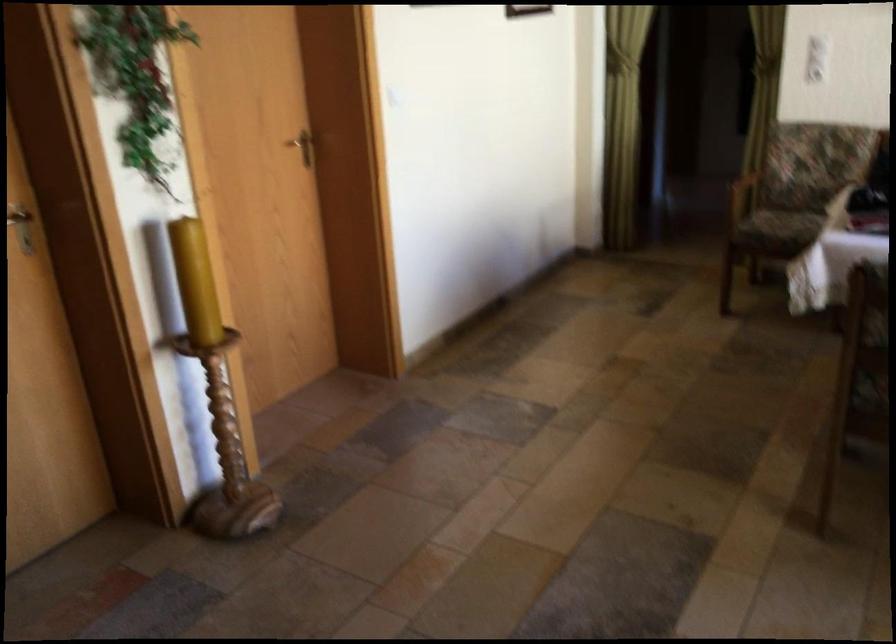
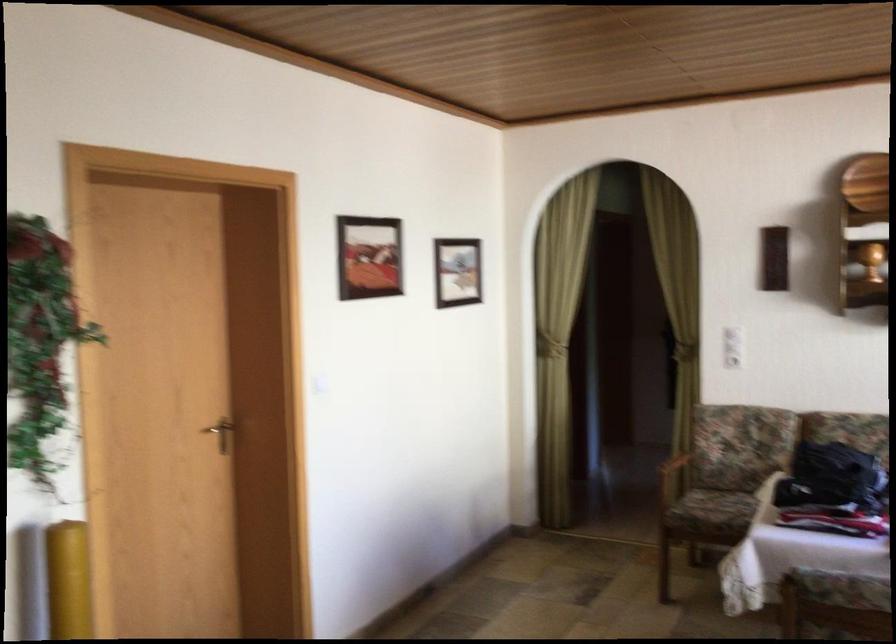
Question: Based on the continuous images, in which direction is the camera rotating? Reply with the corresponding letter.

Choices:
 (A) Left
 (B) Right
 (C) Up
 (D) Down

Answer: (C)